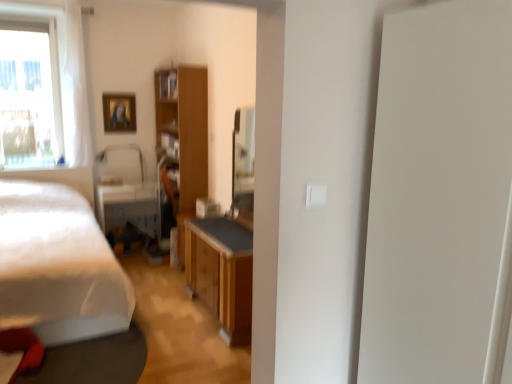
Question: From a real-world perspective, is wooden cabinet at center physically above transparent glass window at upper left?

Choices:
 (A) no
 (B) yes

Answer: (A)

Question: Is transparent glass window at upper left at the back of wooden cabinet at center?

Choices:
 (A) yes
 (B) no

Answer: (B)

Question: Considering the relative positions of wooden cabinet at center and transparent glass window at upper left in the image provided, is wooden cabinet at center in front of transparent glass window at upper left?

Choices:
 (A) yes
 (B) no

Answer: (B)

Question: Is wooden cabinet at center smaller than transparent glass window at upper left?

Choices:
 (A) yes
 (B) no

Answer: (B)

Question: Can we say wooden cabinet at center lies outside transparent glass window at upper left?

Choices:
 (A) no
 (B) yes

Answer: (B)

Question: From their relative heights in the image, would you say matte black swivel chair at center is taller or shorter than wooden cabinet at center?

Choices:
 (A) tall
 (B) short

Answer: (B)

Question: Is matte black swivel chair at center to the left or to the right of wooden cabinet at center in the image?

Choices:
 (A) right
 (B) left

Answer: (B)

Question: Is point (141, 226) closer or farther from the camera than point (165, 130)?

Choices:
 (A) farther
 (B) closer

Answer: (B)

Question: From a real-world perspective, is matte black swivel chair at center above or below wooden cabinet at center?

Choices:
 (A) below
 (B) above

Answer: (A)

Question: Relative to wooden picture frame at upper left, is matte black swivel chair at center in front or behind?

Choices:
 (A) front
 (B) behind

Answer: (A)

Question: Considering the positions of matte black swivel chair at center and wooden picture frame at upper left in the image, is matte black swivel chair at center taller or shorter than wooden picture frame at upper left?

Choices:
 (A) short
 (B) tall

Answer: (B)

Question: From a real-world perspective, is matte black swivel chair at center positioned above or below wooden picture frame at upper left?

Choices:
 (A) above
 (B) below

Answer: (B)

Question: In the image, is matte black swivel chair at center on the left side or the right side of wooden picture frame at upper left?

Choices:
 (A) right
 (B) left

Answer: (A)

Question: In the image, is wooden cabinet at center on the left side or the right side of transparent glass window at upper left?

Choices:
 (A) left
 (B) right

Answer: (B)

Question: Relative to transparent glass window at upper left, is wooden cabinet at center in front or behind?

Choices:
 (A) front
 (B) behind

Answer: (B)